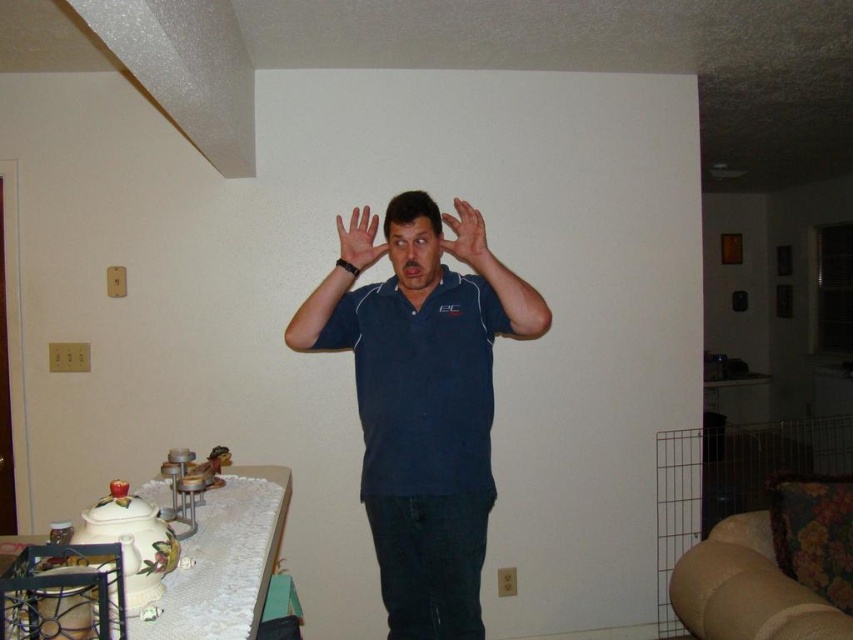
Is dark blue polo shirt at center smaller than matte blue shirt at center?

No, dark blue polo shirt at center is not smaller than matte blue shirt at center.

Is dark blue polo shirt at center taller than matte blue shirt at center?

Yes.

Which is in front, point (399, 355) or point (448, 225)?

Point (399, 355) is more forward.

Identify the location of dark blue polo shirt at center. Image resolution: width=853 pixels, height=640 pixels. click(x=422, y=412).

Is matte blue shirt at center positioned behind matte black hand at center?

No.

Is point (477, 221) farther from camera compared to point (366, 212)?

No, (477, 221) is in front of (366, 212).

I want to click on matte blue shirt at center, so click(467, 237).

Between point (367, 353) and point (357, 218), which one is positioned in front?

Positioned in front is point (357, 218).

The height and width of the screenshot is (640, 853). Identify the location of dark blue polo shirt at center. (422, 412).